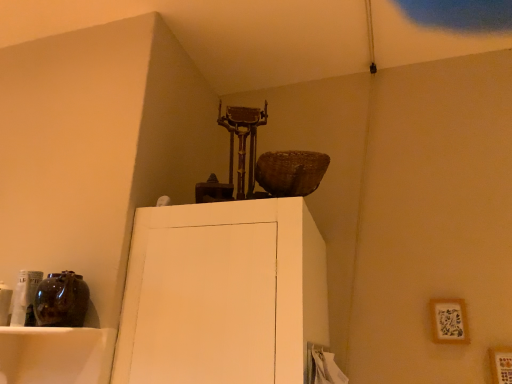
Locate an element on the screen. wooden picture frame at upper right, which is counted as the second picture frame, starting from the front is located at coordinates (449, 321).

Measure the distance between wooden picture frame at upper right, the 2th picture frame ordered from the bottom, and camera.

They are 6.56 feet apart.

Describe the element at coordinates (449, 321) in the screenshot. I see `wooden picture frame at upper right, which is counted as the second picture frame, starting from the front` at that location.

The height and width of the screenshot is (384, 512). Describe the element at coordinates (501, 364) in the screenshot. I see `wooden picture frame at lower right, which ranks as the second picture frame in back-to-front order` at that location.

Where is `wooden picture frame at lower right, marked as the second picture frame in a left-to-right arrangement`? The image size is (512, 384). wooden picture frame at lower right, marked as the second picture frame in a left-to-right arrangement is located at coordinates (501, 364).

In order to face wooden picture frame at lower right, the first picture frame ordered from the bottom, should I rotate leftwards or rightwards?

Turn right by 31.039 degrees to look at wooden picture frame at lower right, the first picture frame ordered from the bottom.

Where is `wooden picture frame at upper right, the 1th picture frame positioned from the back`? This screenshot has width=512, height=384. wooden picture frame at upper right, the 1th picture frame positioned from the back is located at coordinates point(449,321).

Is wooden picture frame at lower right, which is counted as the first picture frame, starting from the front, at the right side of wooden picture frame at upper right, the 2th picture frame ordered from the bottom?

Indeed, wooden picture frame at lower right, which is counted as the first picture frame, starting from the front, is positioned on the right side of wooden picture frame at upper right, the 2th picture frame ordered from the bottom.

Is wooden picture frame at lower right, which appears as the second picture frame when viewed from the top, positioned in front of wooden picture frame at upper right, the 1th picture frame positioned from the back?

Yes, the depth of wooden picture frame at lower right, which appears as the second picture frame when viewed from the top, is less than that of wooden picture frame at upper right, the 1th picture frame positioned from the back.

Which is in front, point (508, 375) or point (439, 305)?

The point (508, 375) is more forward.

From the image's perspective, is wooden picture frame at lower right, which appears as the second picture frame when viewed from the top, above or below wooden picture frame at upper right, the 2th picture frame ordered from the bottom?

From the image's perspective, wooden picture frame at lower right, which appears as the second picture frame when viewed from the top, appears below wooden picture frame at upper right, the 2th picture frame ordered from the bottom.

Looking at this image, from a real-world perspective, which is physically below, wooden picture frame at lower right, which ranks as the second picture frame in back-to-front order, or wooden picture frame at upper right, positioned as the first picture frame in left-to-right order?

In real-world perspective, wooden picture frame at lower right, which ranks as the second picture frame in back-to-front order, is lower.

Between wooden picture frame at lower right, marked as the second picture frame in a left-to-right arrangement, and wooden picture frame at upper right, which is the first picture frame from top to bottom, which one has larger width?

Wider between the two is wooden picture frame at lower right, marked as the second picture frame in a left-to-right arrangement.

In the scene shown: Which of these two, wooden picture frame at lower right, positioned as the first picture frame in right-to-left order, or wooden picture frame at upper right, which is counted as the second picture frame, starting from the front, stands taller?

Standing taller between the two is wooden picture frame at upper right, which is counted as the second picture frame, starting from the front.

Does wooden picture frame at lower right, which ranks as the second picture frame in back-to-front order, have a smaller size compared to wooden picture frame at upper right, the 2th picture frame ordered from the bottom?

No, wooden picture frame at lower right, which ranks as the second picture frame in back-to-front order, is not smaller than wooden picture frame at upper right, the 2th picture frame ordered from the bottom.

Is wooden picture frame at lower right, which appears as the second picture frame when viewed from the top, not inside wooden picture frame at upper right, which is counted as the second picture frame, starting from the front?

Absolutely, wooden picture frame at lower right, which appears as the second picture frame when viewed from the top, is external to wooden picture frame at upper right, which is counted as the second picture frame, starting from the front.

Are wooden picture frame at lower right, the first picture frame ordered from the bottom, and wooden picture frame at upper right, which is the first picture frame from top to bottom, located far from each other?

Actually, wooden picture frame at lower right, the first picture frame ordered from the bottom, and wooden picture frame at upper right, which is the first picture frame from top to bottom, are a little close together.

Is wooden picture frame at lower right, the first picture frame ordered from the bottom, turned away from wooden picture frame at upper right, which is counted as the second picture frame, starting from the front?

That's not correct — wooden picture frame at lower right, the first picture frame ordered from the bottom, is not looking away from wooden picture frame at upper right, which is counted as the second picture frame, starting from the front.

What's the angular difference between wooden picture frame at lower right, marked as the second picture frame in a left-to-right arrangement, and wooden picture frame at upper right, the 1th picture frame positioned from the back,'s facing directions?

They differ by 0.000599 degrees in their facing directions.

Could you measure the distance between wooden picture frame at lower right, which ranks as the second picture frame in back-to-front order, and wooden picture frame at upper right, the 2th picture frame ordered from the bottom?

They are 7.64 inches apart.

Locate an element on the screen. This screenshot has height=384, width=512. picture frame located above the wooden picture frame at lower right, which ranks as the second picture frame in back-to-front order (from the image's perspective) is located at coordinates (449, 321).

Which is more to the right, wooden picture frame at upper right, which appears as the 2th picture frame when viewed from the right, or wooden picture frame at lower right, which ranks as the second picture frame in back-to-front order?

From the viewer's perspective, wooden picture frame at lower right, which ranks as the second picture frame in back-to-front order, appears more on the right side.

Between wooden picture frame at upper right, which is the first picture frame from top to bottom, and wooden picture frame at lower right, which ranks as the second picture frame in back-to-front order, which one is positioned behind?

Positioned behind is wooden picture frame at upper right, which is the first picture frame from top to bottom.

Does point (454, 299) come closer to viewer compared to point (507, 351)?

No.

From the image's perspective, is wooden picture frame at upper right, which appears as the 2th picture frame when viewed from the right, beneath wooden picture frame at lower right, marked as the second picture frame in a left-to-right arrangement?

Incorrect, from the image's perspective, wooden picture frame at upper right, which appears as the 2th picture frame when viewed from the right, is higher than wooden picture frame at lower right, marked as the second picture frame in a left-to-right arrangement.

From a real-world perspective, is wooden picture frame at upper right, positioned as the first picture frame in left-to-right order, under wooden picture frame at lower right, the first picture frame ordered from the bottom?

No, from a real-world perspective, wooden picture frame at upper right, positioned as the first picture frame in left-to-right order, is not beneath wooden picture frame at lower right, the first picture frame ordered from the bottom.

Between wooden picture frame at upper right, which is counted as the second picture frame, starting from the front, and wooden picture frame at lower right, which ranks as the second picture frame in back-to-front order, which one has smaller width?

Thinner between the two is wooden picture frame at upper right, which is counted as the second picture frame, starting from the front.

In terms of height, does wooden picture frame at upper right, which is the first picture frame from top to bottom, look taller or shorter compared to wooden picture frame at lower right, which ranks as the second picture frame in back-to-front order?

A: wooden picture frame at upper right, which is the first picture frame from top to bottom, is shorter than wooden picture frame at lower right, which ranks as the second picture frame in back-to-front order.

Between wooden picture frame at upper right, which appears as the 2th picture frame when viewed from the right, and wooden picture frame at lower right, which ranks as the second picture frame in back-to-front order, which one has smaller size?

wooden picture frame at upper right, which appears as the 2th picture frame when viewed from the right.

Is wooden picture frame at lower right, positioned as the first picture frame in right-to-left order, completely or partially inside wooden picture frame at upper right, the 2th picture frame ordered from the bottom?

No, wooden picture frame at lower right, positioned as the first picture frame in right-to-left order, is not a part of wooden picture frame at upper right, the 2th picture frame ordered from the bottom.

Can you see wooden picture frame at upper right, which appears as the 2th picture frame when viewed from the right, touching wooden picture frame at lower right, which appears as the second picture frame when viewed from the top?

No, wooden picture frame at upper right, which appears as the 2th picture frame when viewed from the right, is not with wooden picture frame at lower right, which appears as the second picture frame when viewed from the top.

Is wooden picture frame at upper right, positioned as the first picture frame in left-to-right order, oriented away from wooden picture frame at lower right, which ranks as the second picture frame in back-to-front order?

No, wooden picture frame at upper right, positioned as the first picture frame in left-to-right order, is not facing away from wooden picture frame at lower right, which ranks as the second picture frame in back-to-front order.

How different are the orientations of wooden picture frame at upper right, which is the first picture frame from top to bottom, and wooden picture frame at lower right, positioned as the first picture frame in right-to-left order, in degrees?

The facing directions of wooden picture frame at upper right, which is the first picture frame from top to bottom, and wooden picture frame at lower right, positioned as the first picture frame in right-to-left order, are 0.000599 degrees apart.

Image resolution: width=512 pixels, height=384 pixels. In order to click on picture frame on the right side of wooden picture frame at upper right, which appears as the 2th picture frame when viewed from the right in this screenshot , I will do `click(501, 364)`.

Find the location of a particular element. The height and width of the screenshot is (384, 512). picture frame located on the left of wooden picture frame at lower right, which appears as the second picture frame when viewed from the top is located at coordinates (449, 321).

Locate an element on the screen. Image resolution: width=512 pixels, height=384 pixels. picture frame positioned vertically above the wooden picture frame at lower right, which ranks as the second picture frame in back-to-front order (from a real-world perspective) is located at coordinates point(449,321).